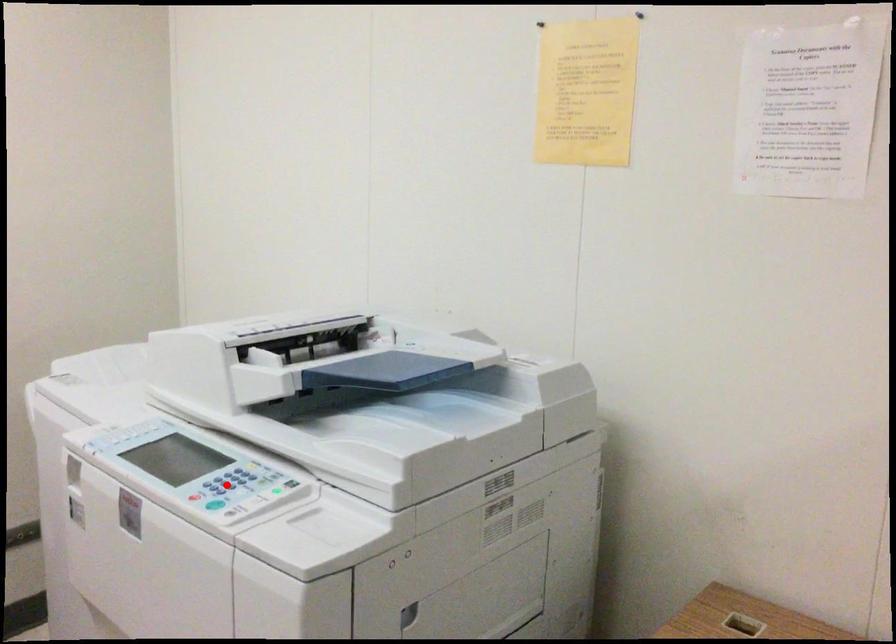
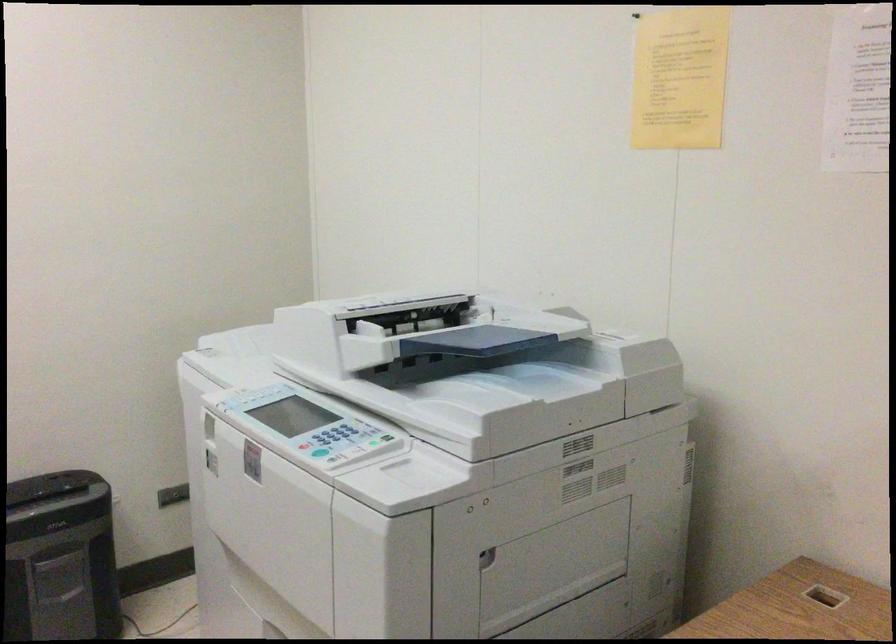
In the second image, find the point that corresponds to the highlighted location in the first image.

(332, 438)